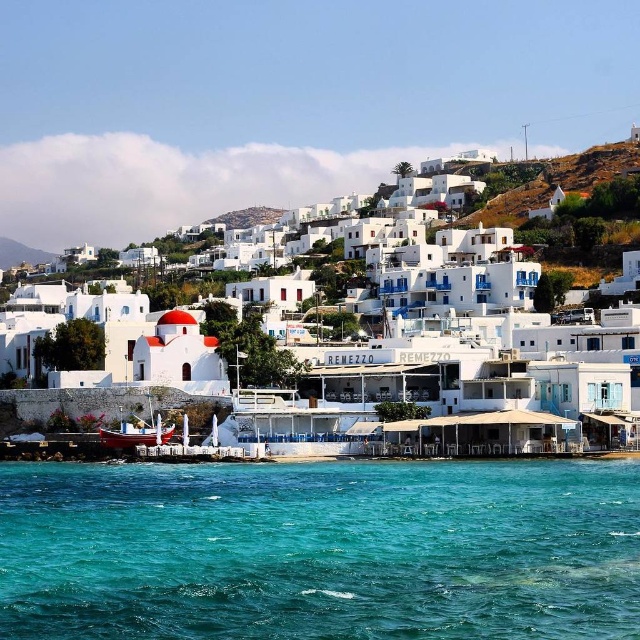
You are standing at the point with coordinates point (102, 429) and want to look towards the point with coordinates point (429, 449). In which direction should you turn your head?

You should turn your head upwards because point (429, 449) is in front of point (102, 429).

You are a tourist standing on the pier and want to take a photo of the turquoise liquid at lower center and the wooden boat at lower left. Which object should you point your camera downward to capture?

You should point your camera downward to capture the turquoise liquid at lower center because it is located below the wooden boat at lower left.

You are standing at the edge of the waterfront and see two points marked in the scene. The first point is at coordinates point (x=54, y=515) and the second is at point (x=138, y=420). Which point is closer to you?

Point (x=54, y=515) is closer to the viewer than point (x=138, y=420).